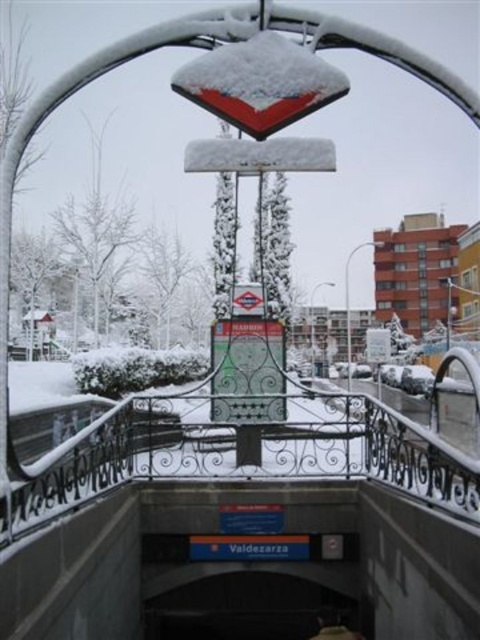
You are a pedestrian trying to find the subway entrance in Valdezarza. You see a metallic silver streetlamp at center and a metallic lamp post at center. Which one is higher?

The metallic silver streetlamp at center is above the metallic lamp post at center, so it is higher.

You are a photographer standing at the subway entrance and want to take a photo of the metallic silver streetlamp at center and the metallic lamp post at center. Which one appears larger in the photo?

The metallic silver streetlamp at center appears larger in the photo because it is closer to the viewer than the metallic lamp post at center.